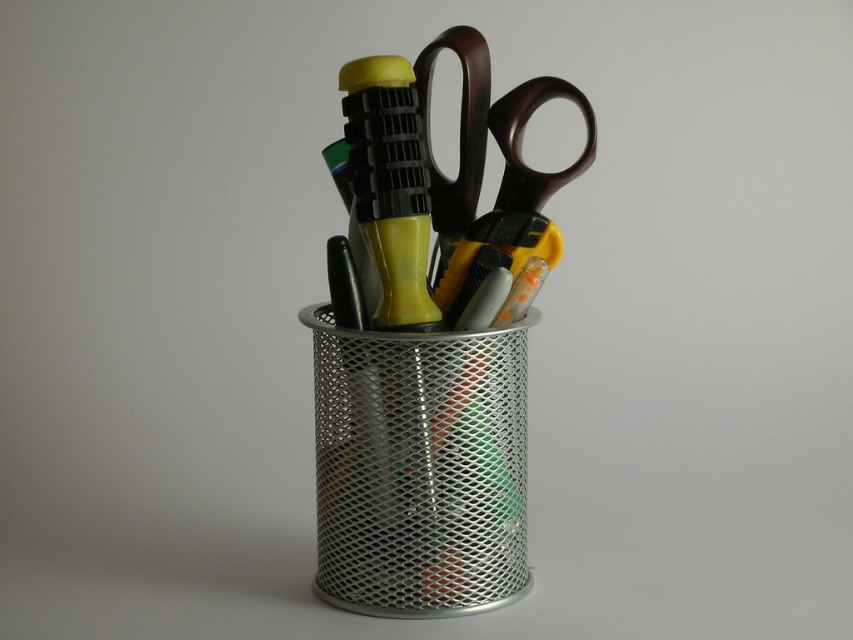
Can you confirm if metal mesh pen holder at center is positioned to the right of brown plastic scissors at center?

In fact, metal mesh pen holder at center is to the left of brown plastic scissors at center.

Who is more distant from viewer, (483,564) or (447,259)?

Positioned behind is point (447,259).

Where is `metal mesh pen holder at center`? The height and width of the screenshot is (640, 853). metal mesh pen holder at center is located at coordinates (428, 340).